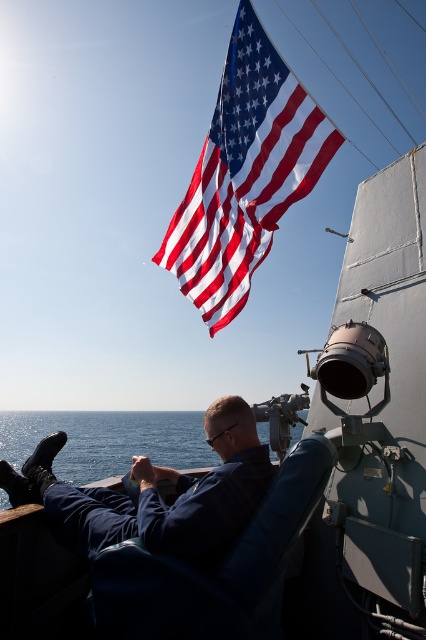
From the picture: Which of these two, red-white striped fabric flag at upper center or blue water at lower left, stands taller?

blue water at lower left is taller.

Based on the photo, does red-white striped fabric flag at upper center appear over blue water at lower left?

Indeed, red-white striped fabric flag at upper center is positioned over blue water at lower left.

I want to click on red-white striped fabric flag at upper center, so click(x=244, y=173).

Can you confirm if red-white striped fabric flag at upper center is taller than blue fabric chair at center?

No, red-white striped fabric flag at upper center is not taller than blue fabric chair at center.

In the scene shown: Does red-white striped fabric flag at upper center come in front of blue fabric chair at center?

No, it is behind blue fabric chair at center.

Is point (282, 72) positioned before point (233, 634)?

No, (282, 72) is further to viewer.

You are a GUI agent. You are given a task and a screenshot of the screen. Output one action in this format:
    pyautogui.click(x=<x>, y=<y>)
    Task: Click on the red-white striped fabric flag at upper center
    Image resolution: width=426 pixels, height=640 pixels.
    Given the screenshot: What is the action you would take?
    pyautogui.click(x=244, y=173)

Can you confirm if blue fabric chair at center is positioned to the right of blue water at lower left?

Yes, blue fabric chair at center is to the right of blue water at lower left.

Is blue fabric chair at center bigger than blue water at lower left?

Actually, blue fabric chair at center might be smaller than blue water at lower left.

Which is in front, point (97, 596) or point (43, 422)?

Point (97, 596) is more forward.

Identify the location of blue fabric chair at center. (215, 570).